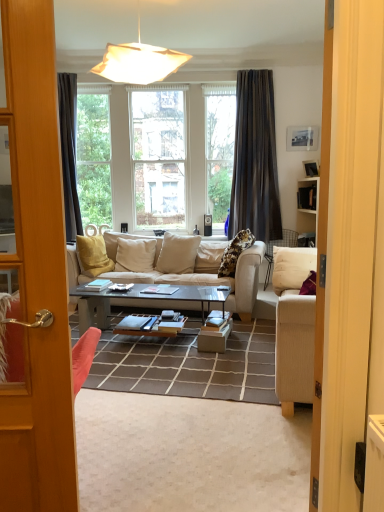
Question: Should I look upward or downward to see matte white pendant light at upper center?

Choices:
 (A) up
 (B) down

Answer: (A)

Question: Does beige fabric couch at center lie behind matte white pendant light at upper center?

Choices:
 (A) no
 (B) yes

Answer: (B)

Question: Is matte white pendant light at upper center a part of beige fabric couch at center?

Choices:
 (A) no
 (B) yes

Answer: (A)

Question: Would you say beige fabric couch at center is a long distance from matte white pendant light at upper center?

Choices:
 (A) yes
 (B) no

Answer: (A)

Question: From a real-world perspective, is beige fabric couch at center over matte white pendant light at upper center?

Choices:
 (A) yes
 (B) no

Answer: (B)

Question: From the image's perspective, is beige fabric couch at center over matte white pendant light at upper center?

Choices:
 (A) yes
 (B) no

Answer: (B)

Question: Can you confirm if beige fabric couch at center is wider than matte white pendant light at upper center?

Choices:
 (A) yes
 (B) no

Answer: (A)

Question: Is beige fabric couch at center bigger than dark gray fabric curtain at upper center?

Choices:
 (A) yes
 (B) no

Answer: (A)

Question: Is beige fabric couch at center positioned beyond the bounds of dark gray fabric curtain at upper center?

Choices:
 (A) yes
 (B) no

Answer: (A)

Question: From a real-world perspective, is beige fabric couch at center physically below dark gray fabric curtain at upper center?

Choices:
 (A) no
 (B) yes

Answer: (B)

Question: From a real-world perspective, is beige fabric couch at center on top of dark gray fabric curtain at upper center?

Choices:
 (A) no
 (B) yes

Answer: (A)

Question: Is beige fabric couch at center positioned before dark gray fabric curtain at upper center?

Choices:
 (A) yes
 (B) no

Answer: (A)

Question: Would you say dark gray fabric curtain at upper center is part of beige fabric couch at center's contents?

Choices:
 (A) yes
 (B) no

Answer: (B)

Question: From a real-world perspective, does beige fabric couch at center stand above shiny black glass coffee table at center?

Choices:
 (A) yes
 (B) no

Answer: (A)